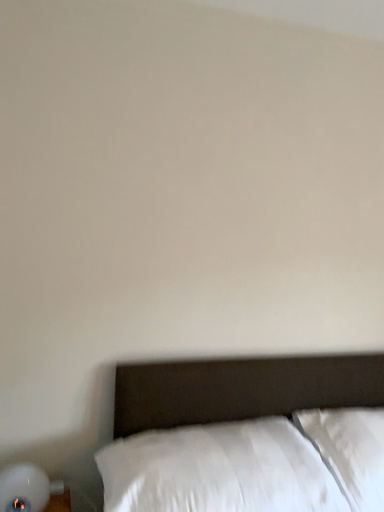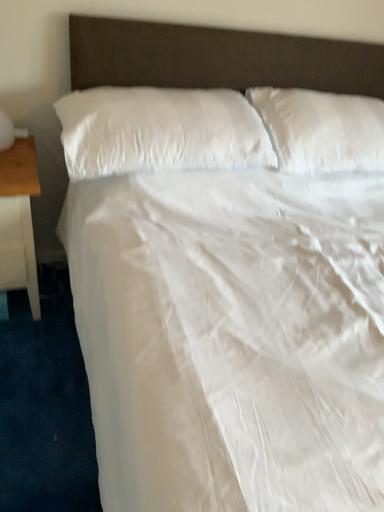
Question: Which way did the camera rotate in the video?

Choices:
 (A) rotated upward
 (B) rotated downward

Answer: (B)